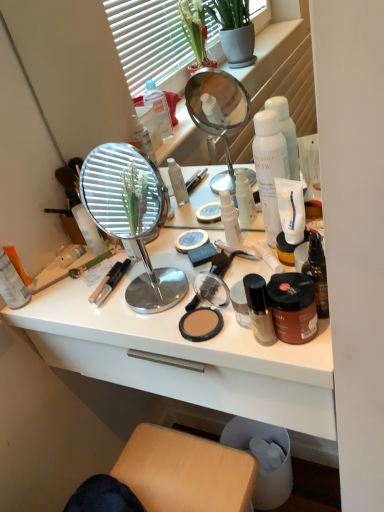
This screenshot has width=384, height=512. Identify the location of vacant region to the left of matte black compact at center. (127, 322).